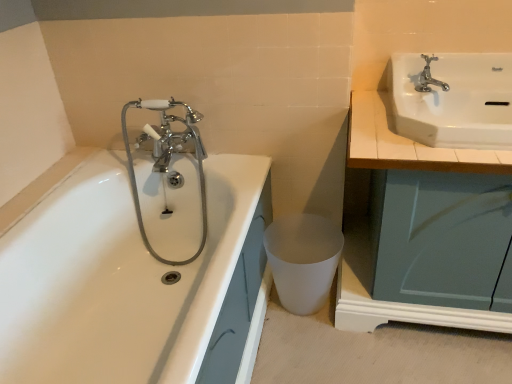
The image size is (512, 384). I want to click on free spot in front of chrome metallic faucet at upper right, so click(455, 110).